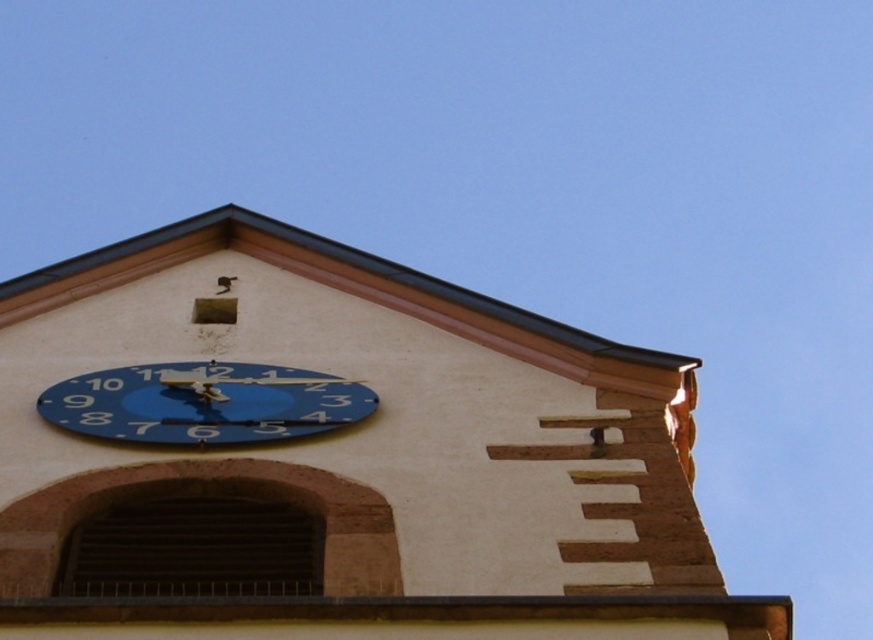
Between blue painted clock face at upper center and blue painted clock face at center, which one has more height?

blue painted clock face at upper center is taller.

Who is higher up, blue painted clock face at upper center or blue painted clock face at center?

blue painted clock face at center is higher up.

At what (x,y) coordinates should I click in order to perform the action: click on blue painted clock face at upper center. Please return your answer as a coordinate pair (x, y). The image size is (873, 640). Looking at the image, I should click on (335, 456).

Identify the location of blue painted clock face at upper center. Image resolution: width=873 pixels, height=640 pixels. (335, 456).